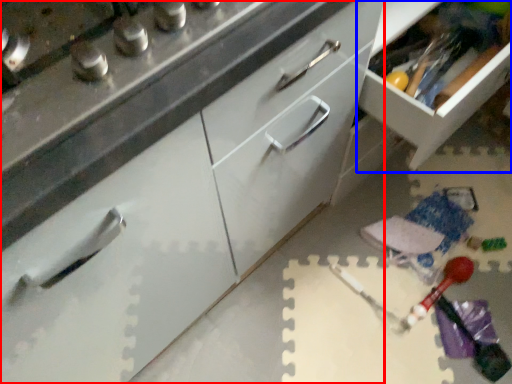
Question: Which object appears closest to the camera in this image, cabinetry (highlighted by a red box) or cabinetry (highlighted by a blue box)?

Choices:
 (A) cabinetry
 (B) cabinetry

Answer: (A)